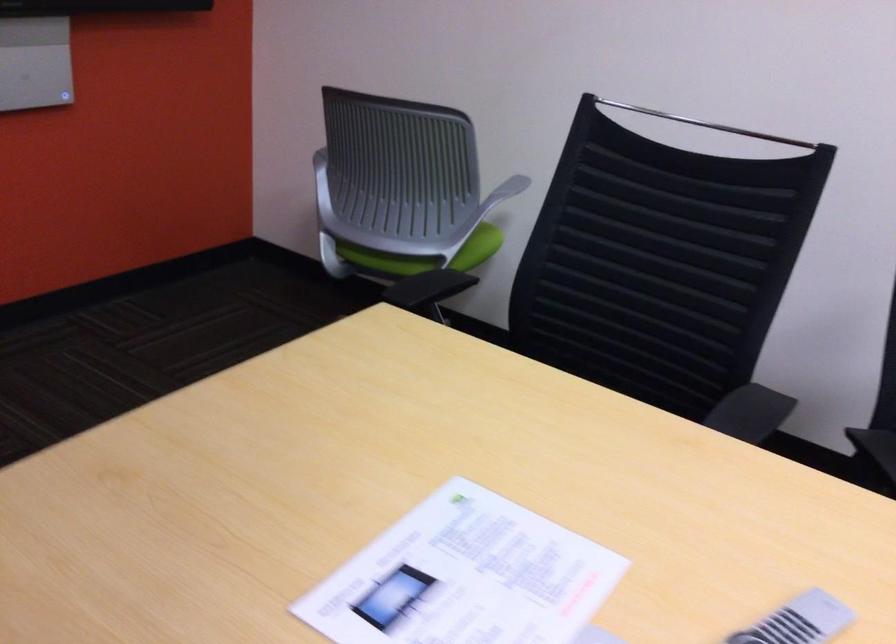
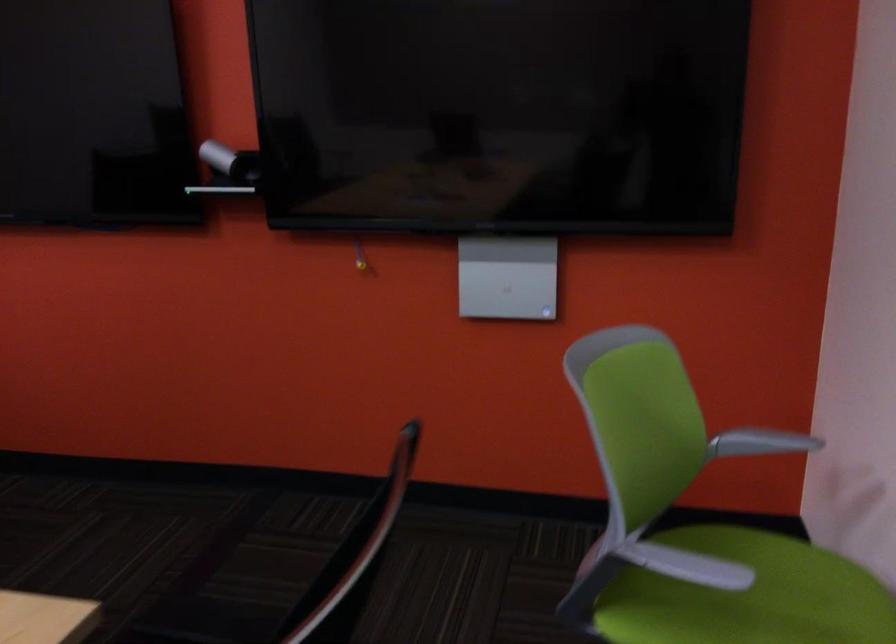
Find the pixel in the second image that matches pixel 440 225 in the first image.

(747, 596)